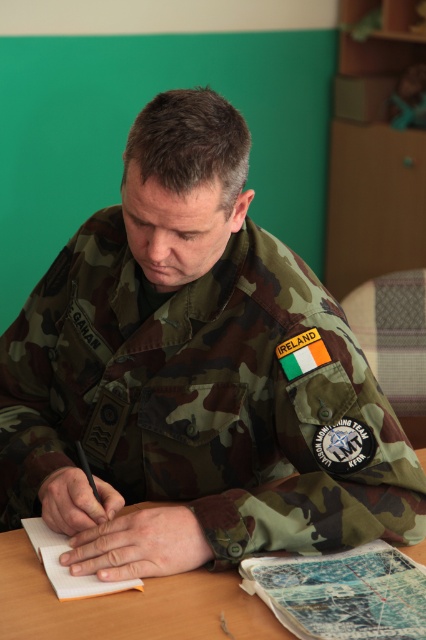
Question: Which object appears farthest from the camera in this image?

Choices:
 (A) wooden table at center
 (B) white paper notebook at center

Answer: (B)

Question: Does wooden table at center have a lesser width compared to white paper notebook at center?

Choices:
 (A) yes
 (B) no

Answer: (B)

Question: Which point is closer to the camera?

Choices:
 (A) wooden table at center
 (B) white paper notebook at lower center

Answer: (B)

Question: Can you confirm if wooden table at center is positioned below white paper notebook at lower center?

Choices:
 (A) no
 (B) yes

Answer: (A)

Question: Considering the real-world distances, which object is farthest from the white paper notebook at center?

Choices:
 (A) wooden table at center
 (B) white paper notebook at lower center

Answer: (B)

Question: Can you confirm if wooden table at center is positioned to the left of white paper notebook at lower center?

Choices:
 (A) no
 (B) yes

Answer: (B)